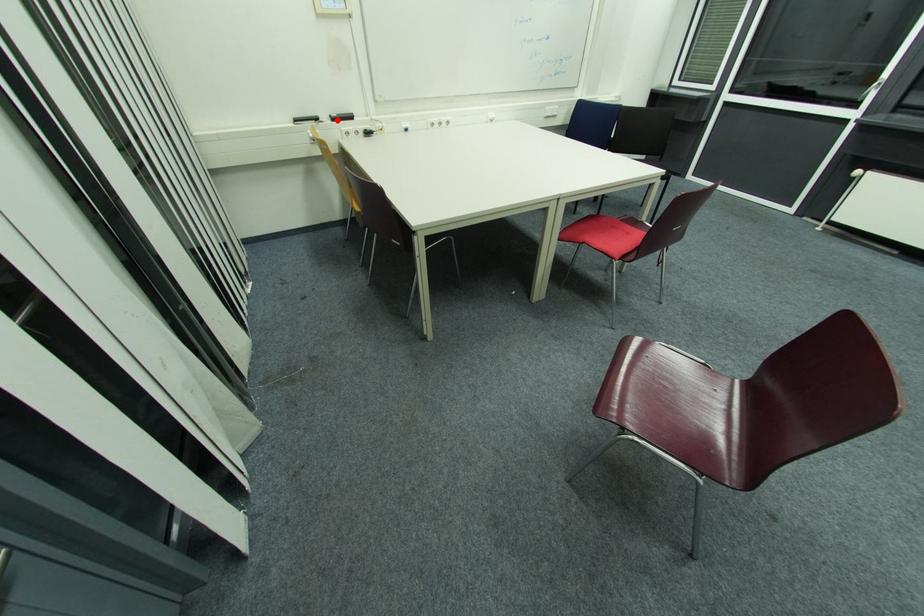
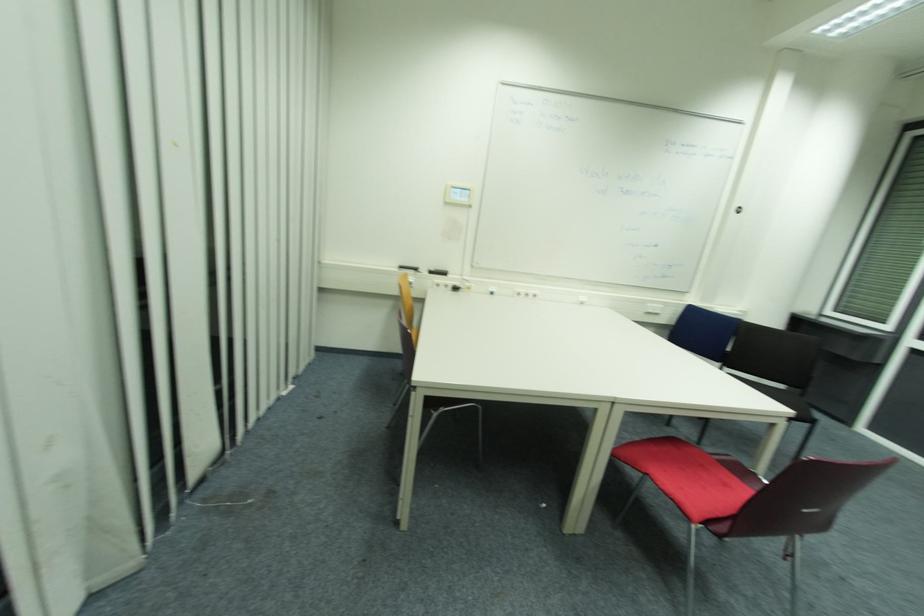
Where in the second image is the point corresponding to the highlighted location from the first image?

(433, 273)